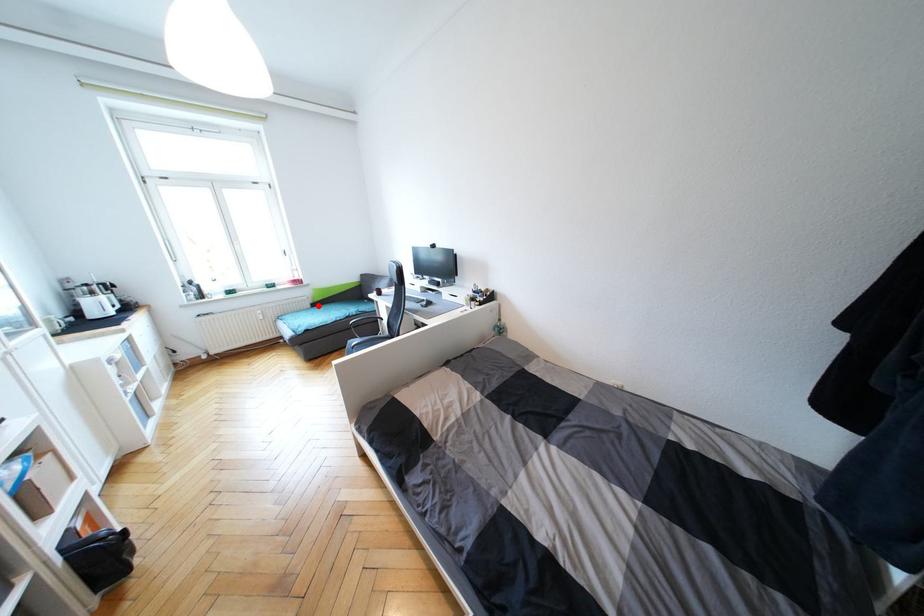
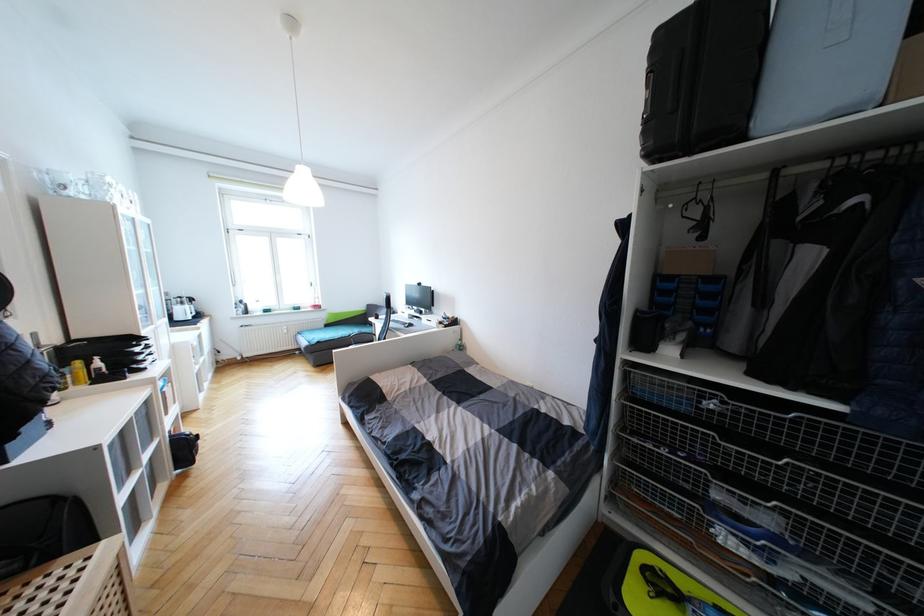
Locate, in the second image, the point that corresponds to the highlighted location in the first image.

(331, 326)